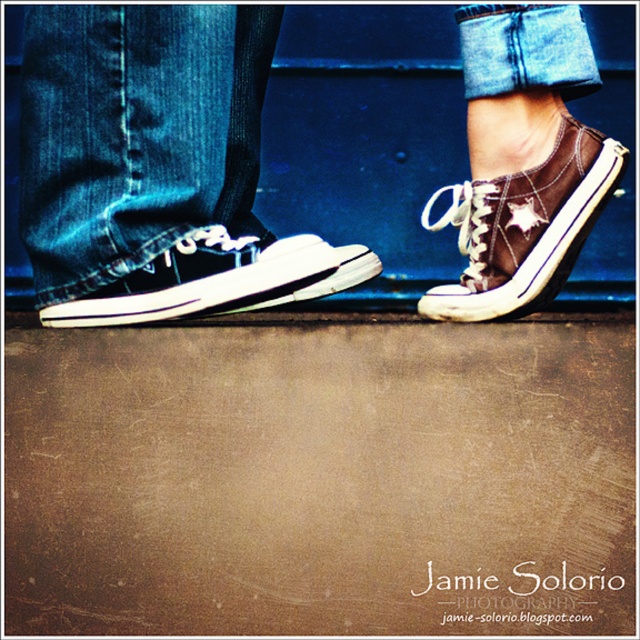
Who is positioned more to the right, matte black sneakers at lower left or brown canvas shoe at right?

brown canvas shoe at right is more to the right.

What do you see at coordinates (156, 166) in the screenshot? The width and height of the screenshot is (640, 640). I see `matte black sneakers at lower left` at bounding box center [156, 166].

The height and width of the screenshot is (640, 640). Find the location of `matte black sneakers at lower left`. matte black sneakers at lower left is located at coordinates (156, 166).

Is matte black sneakers at lower left positioned at the back of matte black sneaker at center?

Yes, matte black sneakers at lower left is behind matte black sneaker at center.

At what (x,y) coordinates should I click in order to perform the action: click on matte black sneakers at lower left. Please return your answer as a coordinate pair (x, y). The image size is (640, 640). Looking at the image, I should click on (156, 166).

Does brown canvas shoe at right appear on the left side of matte black sneaker at center?

Incorrect, brown canvas shoe at right is not on the left side of matte black sneaker at center.

Which is more to the left, brown canvas shoe at right or matte black sneaker at center?

matte black sneaker at center

Does point (541, 220) come farther from viewer compared to point (282, 292)?

Yes.

In order to click on brown canvas shoe at right in this screenshot , I will do `click(524, 227)`.